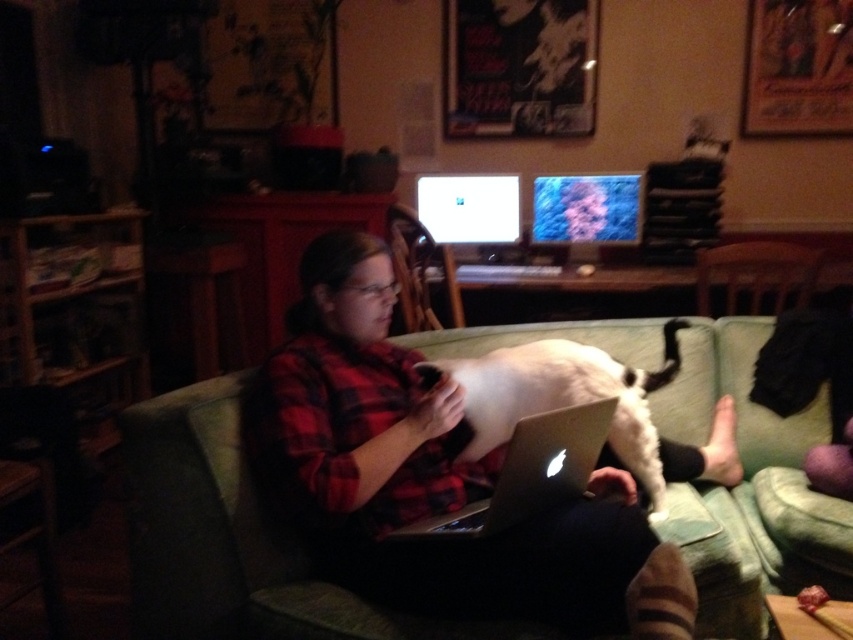
Question: Is white fur cat at center positioned before silver metallic laptop at center?

Choices:
 (A) no
 (B) yes

Answer: (A)

Question: Among these objects, which one is nearest to the camera?

Choices:
 (A) wooden chair at right
 (B) matte plastic chair at center
 (C) matte plastic monitor at upper center
 (D) white glossy monitor at upper center

Answer: (B)

Question: Is matte plastic monitor at upper center in front of white glossy monitor at upper center?

Choices:
 (A) no
 (B) yes

Answer: (B)

Question: Which object is the closest to the silver metallic laptop at center?

Choices:
 (A) matte plastic chair at center
 (B) white fur cat at center
 (C) wooden chair at right

Answer: (B)

Question: Observing the image, what is the correct spatial positioning of matte plastic monitor at upper center in reference to white glossy monitor at upper center?

Choices:
 (A) right
 (B) left

Answer: (A)

Question: Which object appears farthest from the camera in this image?

Choices:
 (A) matte plastic monitor at upper center
 (B) white glossy monitor at upper center
 (C) white fur cat at center

Answer: (B)